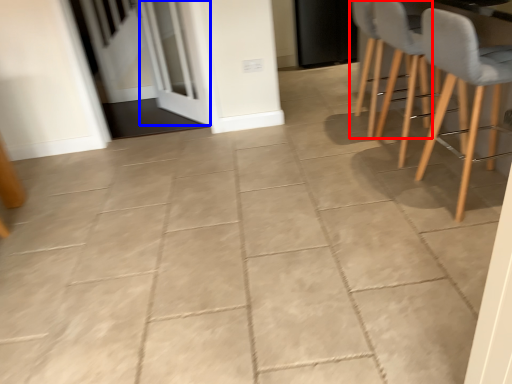
Question: Which of the following is the farthest to the observer, chair (highlighted by a red box) or screen door (highlighted by a blue box)?

Choices:
 (A) chair
 (B) screen door

Answer: (B)